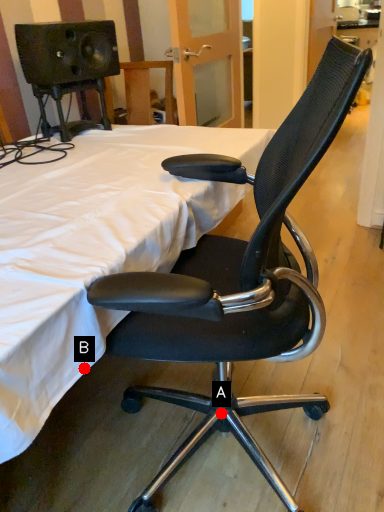
Question: Two points are circled on the image, labeled by A and B beside each circle. Which point is further to the camera?

Choices:
 (A) A is further
 (B) B is further

Answer: (A)